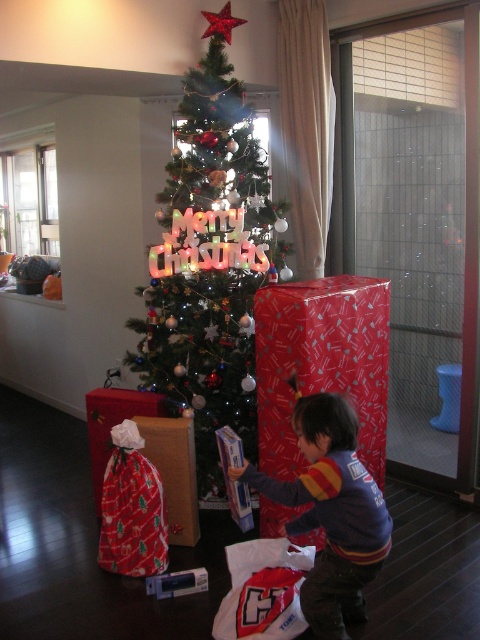
At what (x,y) coordinates should I click in order to perform the action: click on shiny green christmas tree at center. Please return your answer as a coordinate pair (x, y). The height and width of the screenshot is (640, 480). Looking at the image, I should click on (210, 260).

Is shiny green christmas tree at center to the right of striped sweater at lower center from the viewer's perspective?

Incorrect, shiny green christmas tree at center is not on the right side of striped sweater at lower center.

Is point (186, 152) positioned after point (314, 481)?

Yes, point (186, 152) is farther from viewer.

Locate an element on the screen. This screenshot has width=480, height=640. shiny green christmas tree at center is located at coordinates click(210, 260).